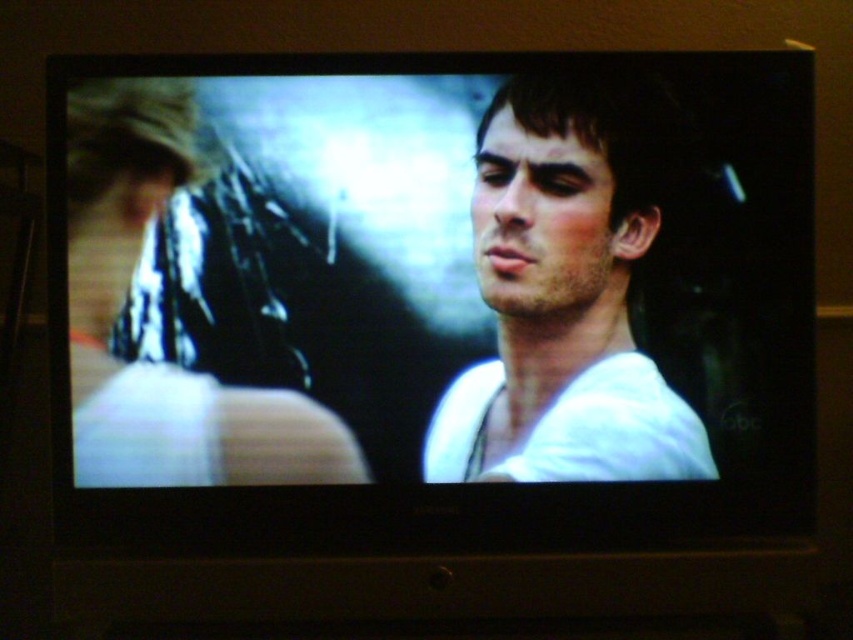
You are trying to take a photo of the white matte screen at center and the white matte shirt at center in the image. If your camera can only focus on objects wider than 20 cm, will both objects be in focus?

The white matte screen at center is larger in width than the white matte shirt at center. Since the camera focuses on objects wider than 20 cm, the white matte screen at center will be in focus, but the white matte shirt at center might not be if its width is less than 20 cm. However, the exact width of the shirt isn

You are an interior designer assessing the placement of a new TV stand. You need to ensure that the white matte screen at center and the white matte shirt at center are visible from a distance. Which object will appear bigger to someone sitting across the room?

The white matte screen at center will appear bigger since it has a larger size compared to the white matte shirt at center.

You are sitting on a couch that is 4 feet away from the white matte screen at center. You want to watch a movie that requires you to be exactly 4 feet away for optimal viewing. Is your current position suitable?

The distance between you and the white matte screen at center is 4.07 feet, which is slightly more than 4 feet. Therefore, your current position is just beyond the optimal viewing distance.